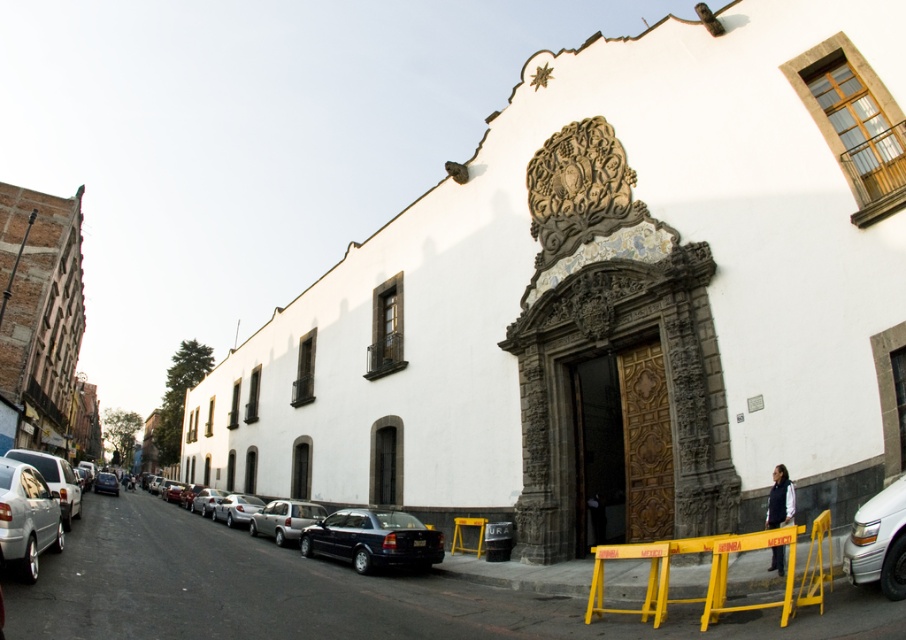
You are a delivery person trying to park your van in the street. You see a yellow plastic barricade at lower center and a white glossy sedan at lower right. Which object is blocking your path closer to your van?

The yellow plastic barricade at lower center is positioned under the white glossy sedan at lower right, so the barricade is closer to your van and blocking your path.

You are a delivery driver approaching the white glossy sedan at lower right and need to stop before reaching the yellow plastic barricade at lower center. Can you safely stop your vehicle within 10 meters if you are currently 15 meters away from the barricade?

The distance between the yellow plastic barricade at lower center and the white glossy sedan at lower right is 10.14 meters. Since you are 15 meters away from the barricade, you have enough space to stop before reaching it as 15 meters is greater than 10.14 meters.